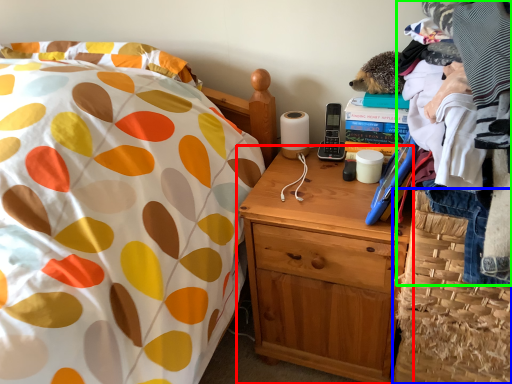
Question: Which is farther away from nightstand (highlighted by a red box)? basket (highlighted by a blue box) or clothing (highlighted by a green box)?

Choices:
 (A) basket
 (B) clothing

Answer: (B)